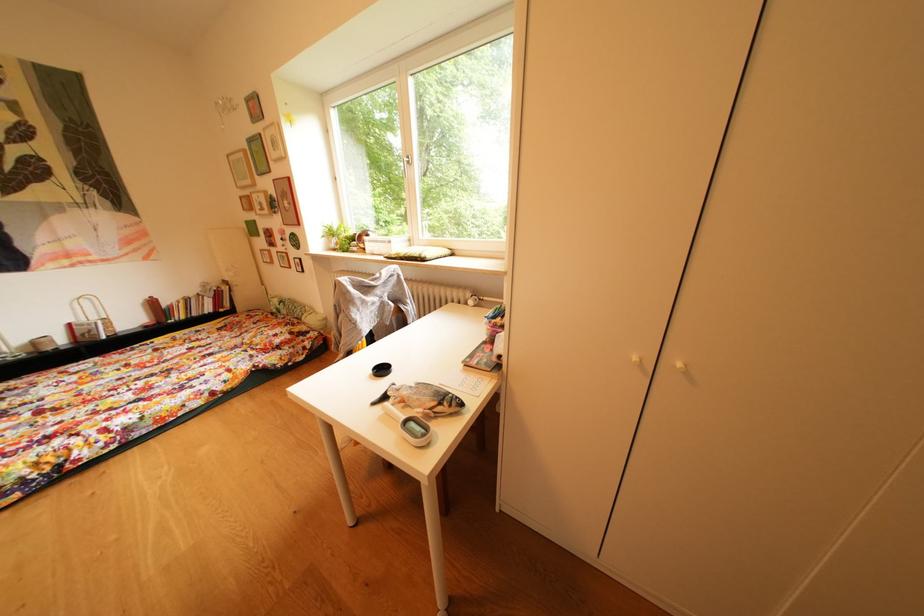
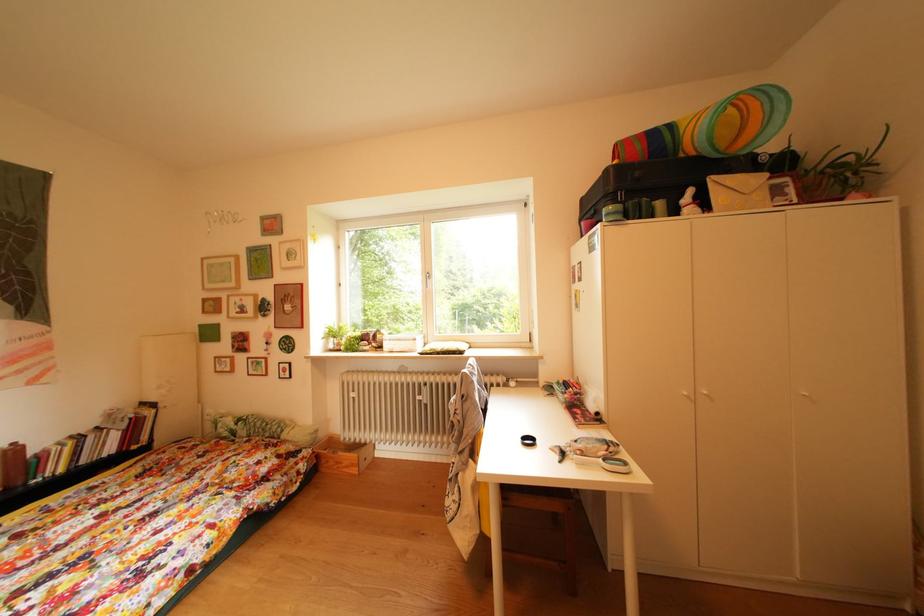
First-person continuous shooting, in which direction is the camera rotating?

The rotation direction of the camera is right-up.